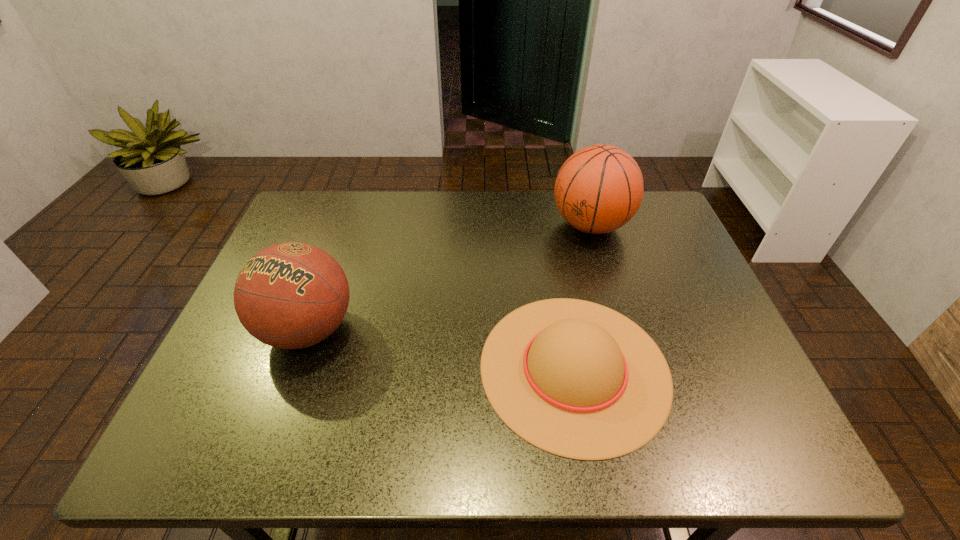
Identify the location of free area in between the shortest object and the farthest object. (583, 296).

This screenshot has width=960, height=540. Find the location of `free space between the sombrero and the nearer basketball`. free space between the sombrero and the nearer basketball is located at coordinates (442, 348).

The height and width of the screenshot is (540, 960). In order to click on free spot between the shortest object and the farther basketball in this screenshot , I will do `click(583, 296)`.

Image resolution: width=960 pixels, height=540 pixels. I want to click on free area in between the shortest object and the farthest object, so 583,296.

You are a GUI agent. You are given a task and a screenshot of the screen. Output one action in this format:
    pyautogui.click(x=<x>, y=<y>)
    Task: Click on the vacant area that lies between the farther basketball and the left basketball
    This screenshot has width=960, height=540.
    Given the screenshot: What is the action you would take?
    pyautogui.click(x=449, y=278)

This screenshot has width=960, height=540. I want to click on free space between the nearer basketball and the right basketball, so click(x=449, y=278).

Locate an element on the screen. Image resolution: width=960 pixels, height=540 pixels. free space between the farther basketball and the shortest object is located at coordinates (583, 296).

Where is `vacant space in between the shortest object and the farther basketball`? The width and height of the screenshot is (960, 540). vacant space in between the shortest object and the farther basketball is located at coordinates (583, 296).

Identify which object is located as the second nearest to the farther basketball. Please provide its 2D coordinates. Your answer should be formatted as a tuple, i.e. [(x, y)], where the tuple contains the x and y coordinates of a point satisfying the conditions above.

[(291, 295)]

Identify which object is the second nearest to the nearer basketball. Please provide its 2D coordinates. Your answer should be formatted as a tuple, i.e. [(x, y)], where the tuple contains the x and y coordinates of a point satisfying the conditions above.

[(599, 188)]